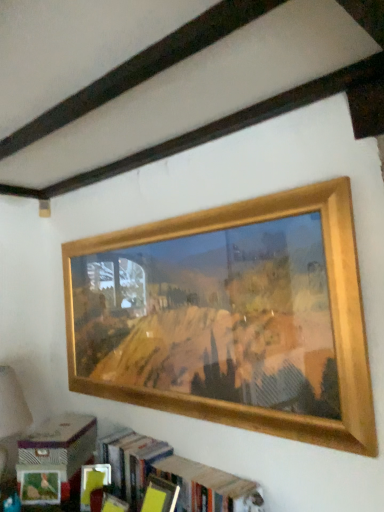
Question: Considering the relative sizes of wooden picture frame at upper center and wooden bookshelf at lower center in the image provided, is wooden picture frame at upper center taller than wooden bookshelf at lower center?

Choices:
 (A) yes
 (B) no

Answer: (A)

Question: From the image's perspective, would you say wooden picture frame at upper center is shown under wooden bookshelf at lower center?

Choices:
 (A) no
 (B) yes

Answer: (A)

Question: Can you confirm if wooden picture frame at upper center is shorter than wooden bookshelf at lower center?

Choices:
 (A) yes
 (B) no

Answer: (B)

Question: From a real-world perspective, is wooden picture frame at upper center located beneath wooden bookshelf at lower center?

Choices:
 (A) no
 (B) yes

Answer: (A)

Question: Does wooden picture frame at upper center have a larger size compared to wooden bookshelf at lower center?

Choices:
 (A) yes
 (B) no

Answer: (A)

Question: Is wooden bookshelf at lower center at the back of wooden picture frame at upper center?

Choices:
 (A) yes
 (B) no

Answer: (B)

Question: From the image's perspective, is matte cardboard box at lower left located beneath wooden bookshelf at lower center?

Choices:
 (A) yes
 (B) no

Answer: (A)

Question: Is there a large distance between matte cardboard box at lower left and wooden bookshelf at lower center?

Choices:
 (A) no
 (B) yes

Answer: (A)

Question: Is the depth of matte cardboard box at lower left greater than that of wooden bookshelf at lower center?

Choices:
 (A) no
 (B) yes

Answer: (B)

Question: Does matte cardboard box at lower left appear on the left side of wooden bookshelf at lower center?

Choices:
 (A) no
 (B) yes

Answer: (B)

Question: Is matte cardboard box at lower left oriented away from wooden bookshelf at lower center?

Choices:
 (A) no
 (B) yes

Answer: (A)

Question: Does matte cardboard box at lower left appear on the right side of wooden bookshelf at lower center?

Choices:
 (A) yes
 (B) no

Answer: (B)

Question: Can you confirm if matte cardboard box at lower left is bigger than wooden picture frame at upper center?

Choices:
 (A) no
 (B) yes

Answer: (A)